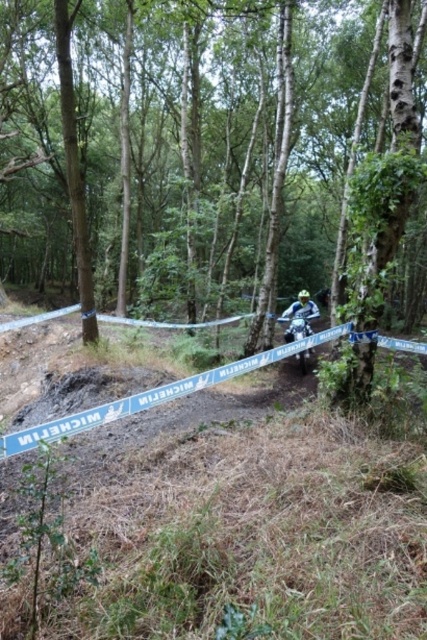
You are a photographer positioned at the edge of the forest. You need to capture a photo of both the brown bark tree at center and the blue metallic motorcycle at center. Based on their sizes, which object will appear bigger in your photo?

The brown bark tree at center will appear bigger in the photo because it is larger in size than the blue metallic motorcycle at center.

You are a drone operator trying to capture aerial footage of the motocross event. Your drone is currently at a height of 30 meters above the ground. You need to fly it to the point marked at coordinates point (163, 129) to get the perfect shot. Is your drone within range to reach that point without descending below 25 meters?

The point (163, 129) is 26.01 meters from the camera. Since the drone is at 30 meters and needs to stay above 25 meters, it can descend to 26.01 meters to reach the point, which is within the required altitude range.

Looking at this image, you are a photographer positioned at the edge of the forest, aiming to capture a wide shot of the brown bark tree at center and the blue metallic motorcycle at center. Based on their sizes, which object will appear wider in the photo?

The brown bark tree at center will appear wider in the photo since its width is larger than that of the blue metallic motorcycle at center.